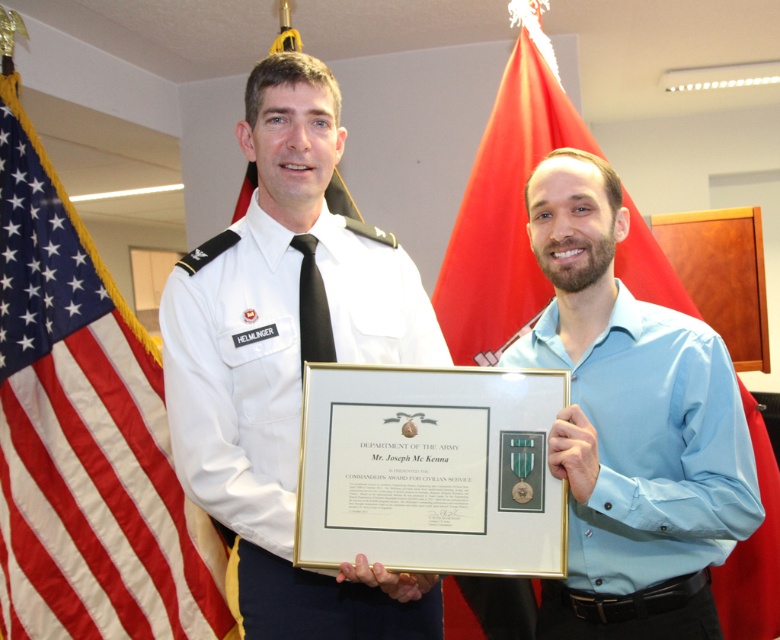
Question: Is red-white striped flag at left thinner than red fabric flag at upper center?

Choices:
 (A) no
 (B) yes

Answer: (B)

Question: Is red-white striped flag at left smaller than white uniform at center?

Choices:
 (A) yes
 (B) no

Answer: (B)

Question: Considering the real-world distances, which object is farthest from the white uniform at center?

Choices:
 (A) red-white striped flag at left
 (B) light blue cotton shirt at center
 (C) red fabric flag at upper center

Answer: (A)

Question: Can you confirm if white uniform at center is positioned above red fabric flag at upper center?

Choices:
 (A) yes
 (B) no

Answer: (B)

Question: Which point appears farthest from the camera in this image?

Choices:
 (A) (165, 291)
 (B) (57, 454)
 (C) (707, 349)
 (D) (470, 304)

Answer: (B)

Question: Which object is the farthest from the white uniform at center?

Choices:
 (A) light blue cotton shirt at center
 (B) red-white striped flag at left
 (C) red fabric flag at upper center

Answer: (B)